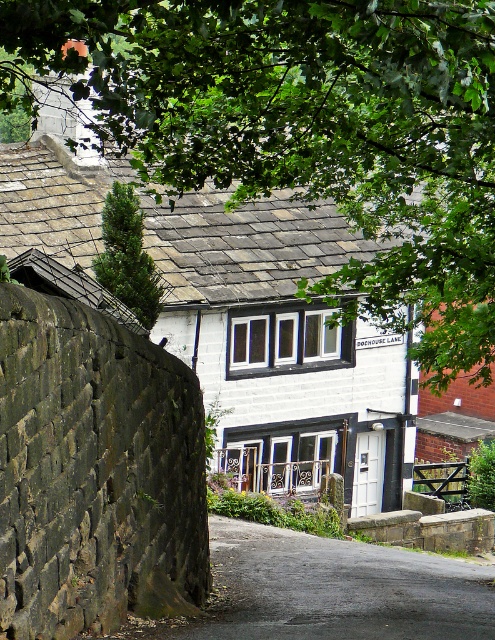
You are a visitor approaching the house on DOCHOUSE LANE. You notice two trees in the background. Which tree, the green leafy tree at upper center or the green coniferous tree at upper left, is larger in size?

The green leafy tree at upper center is bigger than the green coniferous tree at upper left.

Based on the scene description, which tree, the green leafy tree at upper center or the green coniferous tree at upper left, has a greater width?

The green leafy tree at upper center might be wider than the green coniferous tree at upper left according to the description.

Looking at this image, you are standing in front of the traditional house on DOCHOUSE LANE and notice a green leafy tree at upper center. Based on its coordinates, can you determine if it is positioned to the left or right of the center of the image?

The green leafy tree at upper center is located at point 0.203 on the x and 0.618 on the y. Since the x coordinate is less than 0.5, it is positioned to the left of the center of the image.